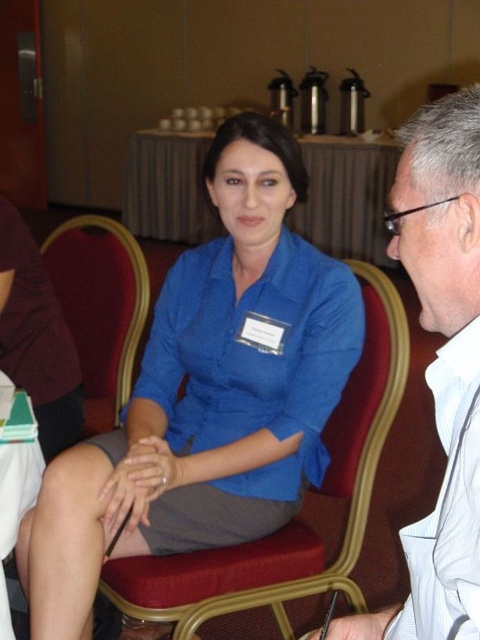
You are organizing a clothing donation drive and need to categorize shirts by size. You have two shirts in front of you, the blue fabric shirt at center and the white cotton shirt at right. Which shirt should you place in the large size bin?

The blue fabric shirt at center has a larger size compared to the white cotton shirt at right, so it should be placed in the large size bin.

You are a photographer at the event and need to capture a photo of both the white glossy shirt at right and the white cotton shirt at right. Since the camera can only focus on one subject at a time, which shirt should you focus on first to ensure both are in the frame?

The white glossy shirt at right is to the left of the white cotton shirt at right, so you should focus on the white glossy shirt at right first to ensure both are in the frame.

You are organizing a small event and need to arrange seating for guests. You have a velvet upholstered chair at center and a white cotton shirt at right. Which object takes up more physical space in the scene?

The velvet upholstered chair at center takes up more physical space than the white cotton shirt at right, as the white cotton shirt at right occupies less space than velvet upholstered chair at center.